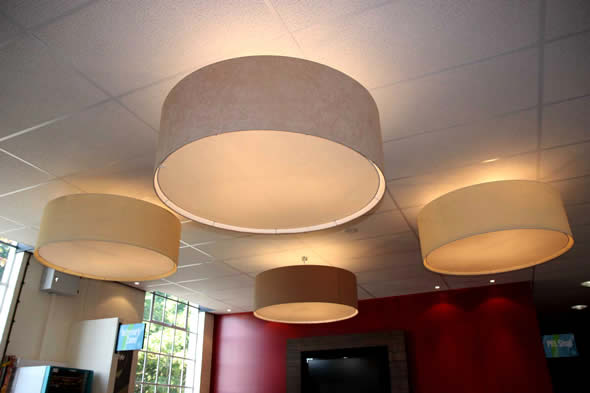
This screenshot has height=393, width=590. Find the location of `window`. window is located at coordinates (173, 350).